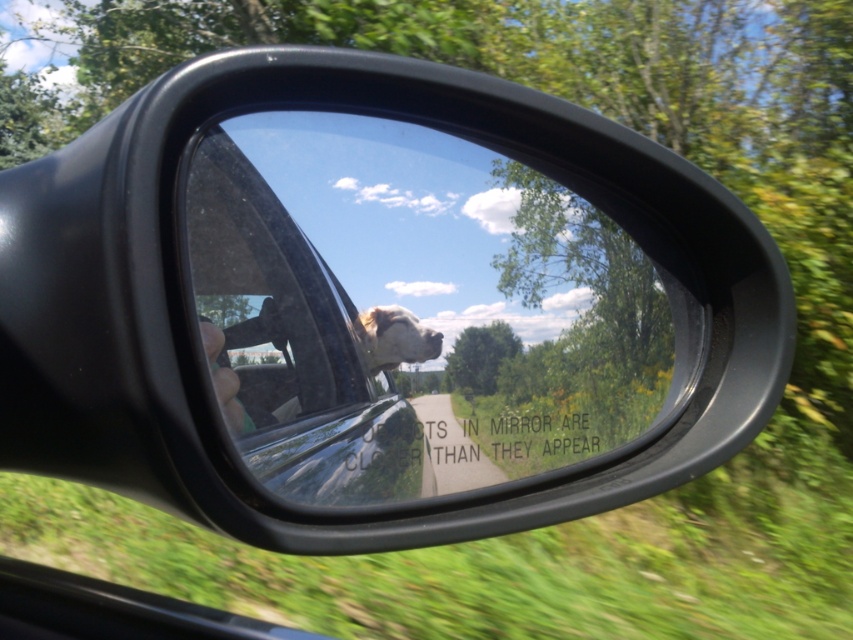
You are a passenger in a car looking at the side mirror reflection. You see the clear glass window at center and the light brown fur at center. Which object in the reflection is nearer to you?

The clear glass window at center is closer to the viewer than the light brown fur at center in the reflection.

You are a passenger in the car and want to see the light brown fur at center of the dog better. Can you look through the clear glass window at center to see it?

The clear glass window at center is above the light brown fur at center, so yes, you can look through the clear glass window at center to see the light brown fur at center as it is positioned below the window.